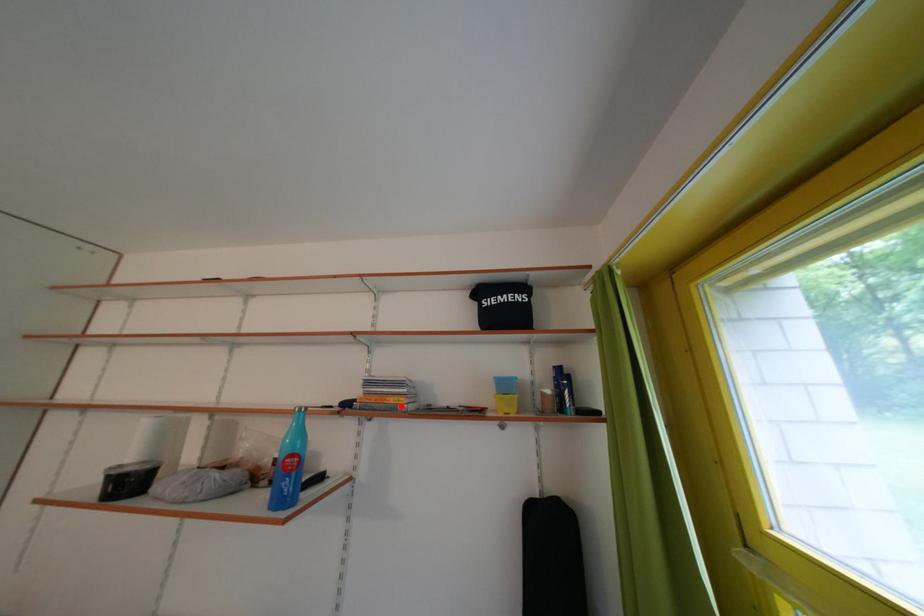
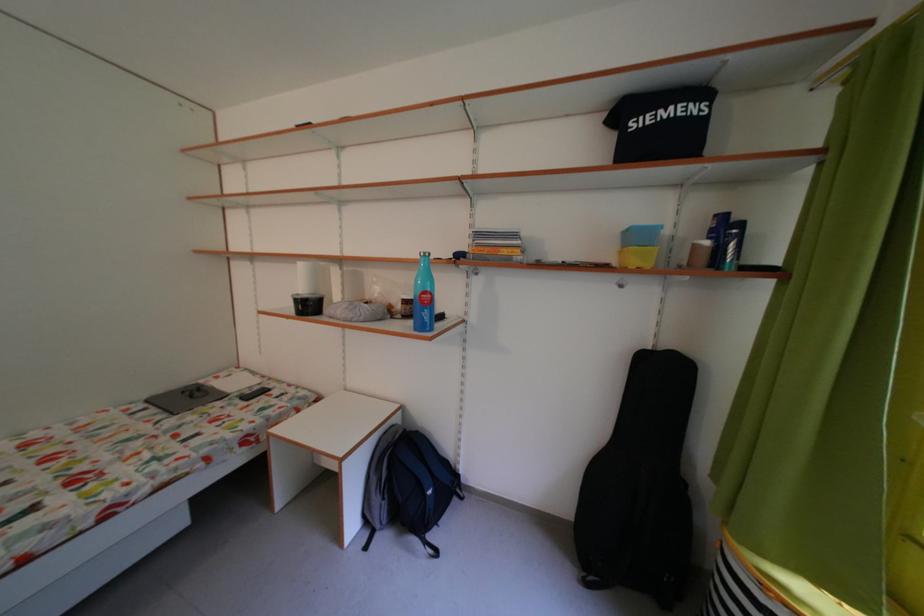
The point at the highlighted location is marked in the first image. Where is the corresponding point in the second image?

(515, 257)